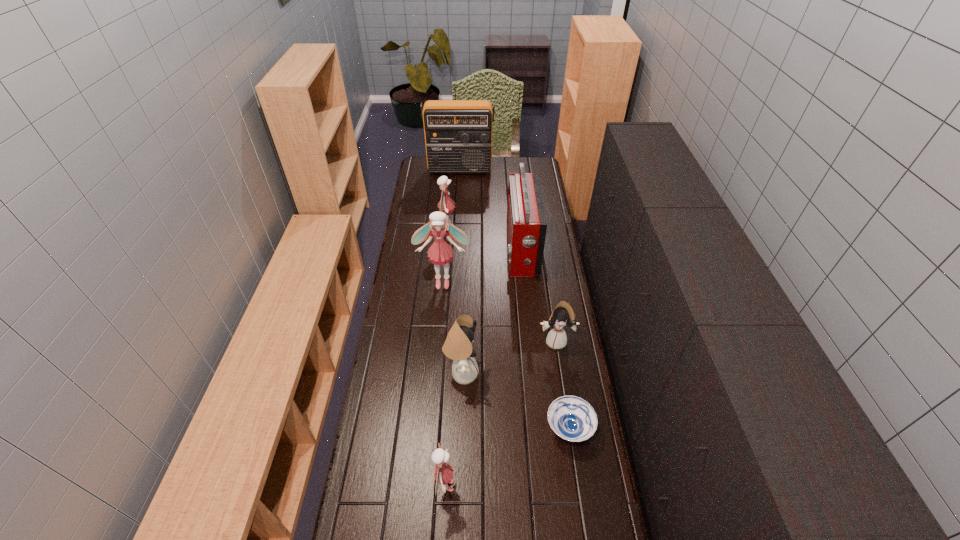
I want to click on the rightmost doll, so click(x=563, y=314).

Identify the location of the right black doll. This screenshot has width=960, height=540. (563, 314).

Where is `the shortest object`? The image size is (960, 540). the shortest object is located at coordinates (572, 418).

Where is `blue soup bowl`? blue soup bowl is located at coordinates (572, 418).

Find the location of `blank space located 0.110m on the front-facing side of the farther radio receiver`. blank space located 0.110m on the front-facing side of the farther radio receiver is located at coordinates (459, 187).

At what (x,y) coordinates should I click in order to perform the action: click on free point located on the front-facing side of the second farthest pink doll. Please return your answer as a coordinate pair (x, y). This screenshot has height=540, width=960. Looking at the image, I should click on (442, 300).

Where is `vacant space located 0.080m on the front-facing side of the right radio receiver`? vacant space located 0.080m on the front-facing side of the right radio receiver is located at coordinates (489, 251).

Find the location of a particular element. free location located on the front-facing side of the right radio receiver is located at coordinates (460, 251).

At what (x,y) coordinates should I click in order to perform the action: click on vacant area located on the front-facing side of the right radio receiver. Please return your answer as a coordinate pair (x, y). This screenshot has height=540, width=960. Looking at the image, I should click on point(495,251).

This screenshot has width=960, height=540. In order to click on blank area located 0.220m on the front-facing side of the second smallest pink doll in this screenshot , I will do `click(500, 228)`.